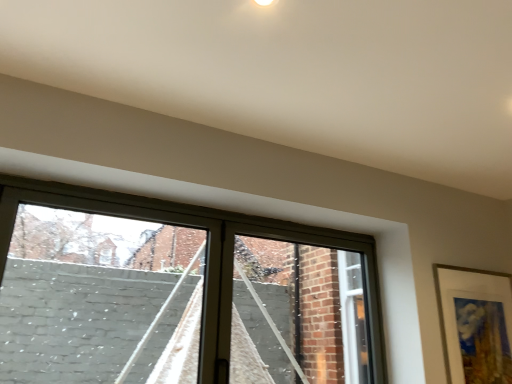
Question: From a real-world perspective, is clear glass window at center under matte white picture frame at right?

Choices:
 (A) no
 (B) yes

Answer: (A)

Question: Does clear glass window at center appear on the right side of matte white picture frame at right?

Choices:
 (A) no
 (B) yes

Answer: (A)

Question: Is the depth of clear glass window at center less than that of matte white picture frame at right?

Choices:
 (A) yes
 (B) no

Answer: (A)

Question: Is clear glass window at center looking in the opposite direction of matte white picture frame at right?

Choices:
 (A) no
 (B) yes

Answer: (A)

Question: Does clear glass window at center have a lesser height compared to matte white picture frame at right?

Choices:
 (A) yes
 (B) no

Answer: (B)

Question: Considering the relative sizes of clear glass window at center and matte white picture frame at right in the image provided, is clear glass window at center smaller than matte white picture frame at right?

Choices:
 (A) no
 (B) yes

Answer: (A)

Question: Does matte white picture frame at right lie in front of clear glass window at center?

Choices:
 (A) yes
 (B) no

Answer: (B)

Question: Is matte white picture frame at right shorter than clear glass window at center?

Choices:
 (A) yes
 (B) no

Answer: (A)

Question: Considering the relative positions of matte white picture frame at right and clear glass window at center in the image provided, is matte white picture frame at right behind clear glass window at center?

Choices:
 (A) yes
 (B) no

Answer: (A)

Question: Is matte white picture frame at right bigger than clear glass window at center?

Choices:
 (A) yes
 (B) no

Answer: (B)

Question: From the image's perspective, is matte white picture frame at right beneath clear glass window at center?

Choices:
 (A) no
 (B) yes

Answer: (B)

Question: From a real-world perspective, is matte white picture frame at right on clear glass window at center?

Choices:
 (A) no
 (B) yes

Answer: (A)

Question: Considering their positions, is matte white picture frame at right located in front of or behind clear glass window at center?

Choices:
 (A) front
 (B) behind

Answer: (B)